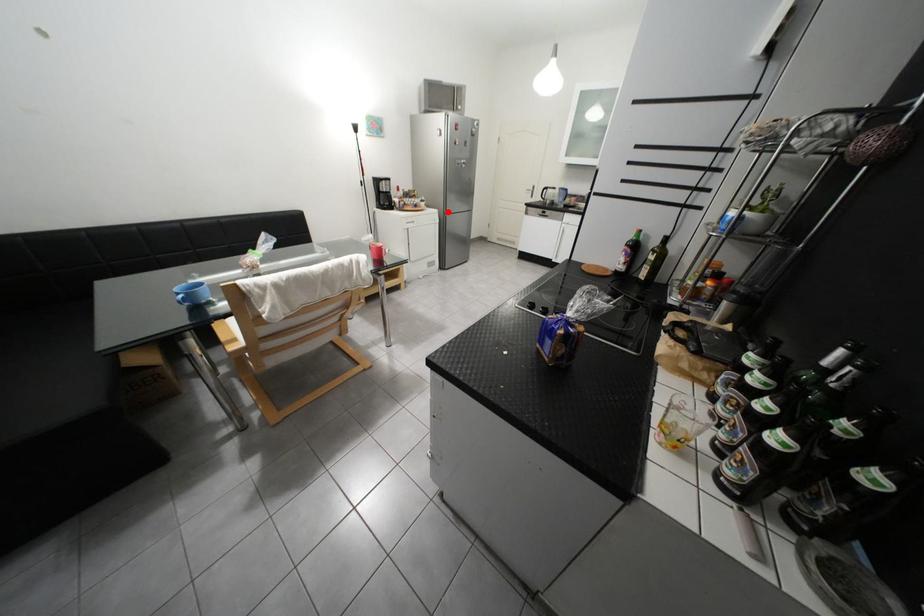
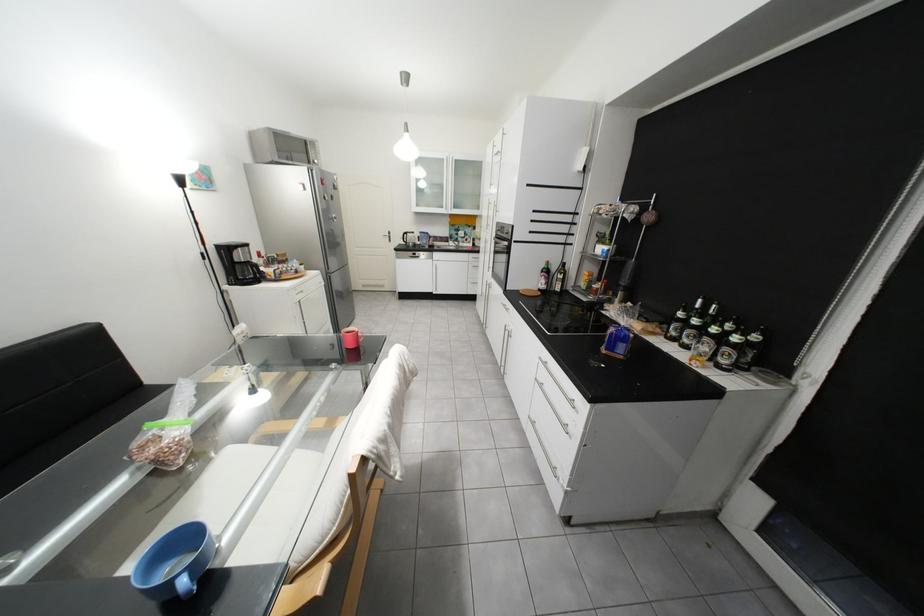
Locate, in the second image, the point that corresponds to the highlighted location in the first image.

(330, 273)